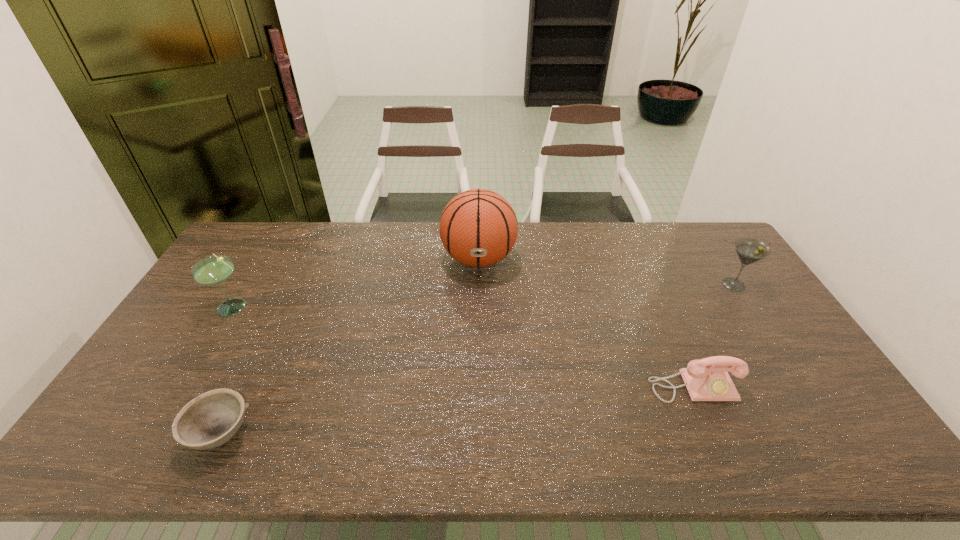
I want to click on the tallest object, so click(478, 228).

Where is `the third object from left to right`? Image resolution: width=960 pixels, height=540 pixels. the third object from left to right is located at coordinates (478, 228).

At what (x,y) coordinates should I click in order to perform the action: click on the rightmost object. Please return your answer as a coordinate pair (x, y). Looking at the image, I should click on 749,250.

Find the location of a particular element. The height and width of the screenshot is (540, 960). the leftmost object is located at coordinates (216, 269).

Find the location of a particular element. The width and height of the screenshot is (960, 540). the second shortest object is located at coordinates click(x=707, y=379).

Image resolution: width=960 pixels, height=540 pixels. I want to click on the second nearest object, so click(x=707, y=379).

Identify the location of the fourth object from right to left. (211, 419).

Identify the location of the shortest object. (211, 419).

I want to click on vacant space located on the side where the inflation valve is located, so click(x=479, y=310).

This screenshot has height=540, width=960. Identify the location of free location located 0.090m on the front of the rightmost object. (755, 316).